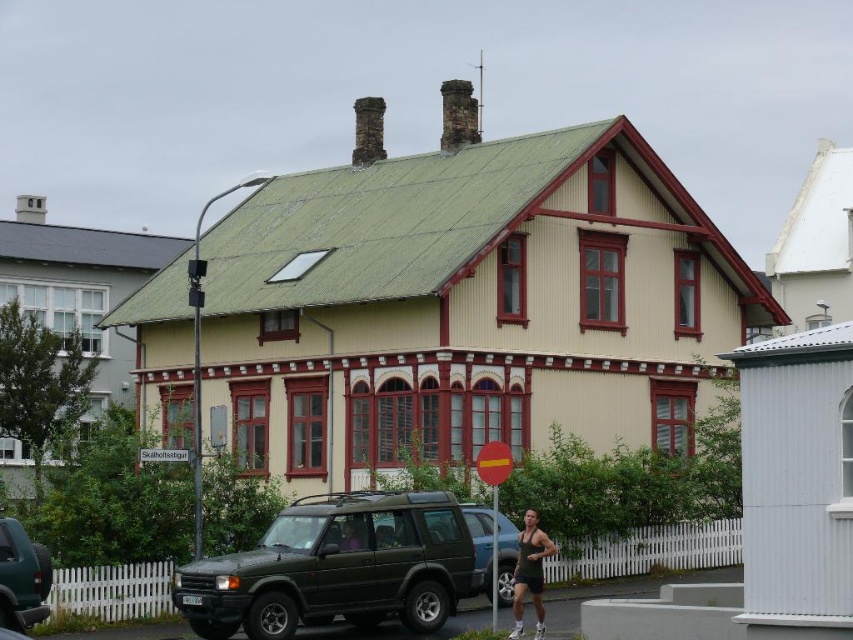
Question: Which of these objects is positioned farthest from the matte green suv at center?

Choices:
 (A) dark green tank top at lower center
 (B) purple fabric shirt at center
 (C) dark green matte suv at center

Answer: (A)

Question: Is dark green matte suv at center positioned in front of dark green tank top at lower center?

Choices:
 (A) no
 (B) yes

Answer: (A)

Question: Which of the following is the farthest from the observer?

Choices:
 (A) dark green matte suv at center
 (B) dark green tank top at lower center
 (C) purple fabric shirt at center

Answer: (A)

Question: Is the position of matte green suv at center less distant than that of matte green suv at lower left?

Choices:
 (A) yes
 (B) no

Answer: (B)

Question: Is matte green suv at center above purple fabric shirt at center?

Choices:
 (A) yes
 (B) no

Answer: (B)

Question: Which object is the farthest from the dark green tank top at lower center?

Choices:
 (A) matte green suv at lower left
 (B) matte green suv at center

Answer: (A)